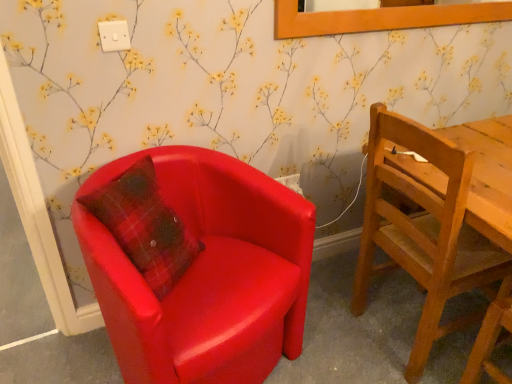
Question: Which is correct: white plastic power outlet at upper center, the first power outlet when ordered from top to bottom, is inside white plastic power outlet at lower center, which is the 2th power outlet from top to bottom, or outside of it?

Choices:
 (A) inside
 (B) outside

Answer: (B)

Question: From the image's perspective, is white plastic power outlet at upper center, acting as the 1th power outlet starting from the front, located above or below white plastic power outlet at lower center, placed as the 1th power outlet when sorted from right to left?

Choices:
 (A) above
 (B) below

Answer: (A)

Question: Which of these objects is positioned closest to the wooden picture frame at upper center?

Choices:
 (A) white plastic power outlet at lower center, which is counted as the second power outlet, starting from the left
 (B) matte red armchair at left, acting as the 2th chair starting from the right
 (C) wooden chair at right, positioned as the 1th chair in right-to-left order
 (D) white plastic power outlet at upper center, which ranks as the 2th power outlet in bottom-to-top order

Answer: (A)

Question: Which is farther from the wooden picture frame at upper center?

Choices:
 (A) matte red armchair at left, arranged as the first chair when viewed from the left
 (B) white plastic power outlet at lower center, which ranks as the first power outlet in back-to-front order
 (C) wooden chair at right, the 2th chair when ordered from left to right
 (D) white plastic power outlet at upper center, the first power outlet viewed from the left

Answer: (D)